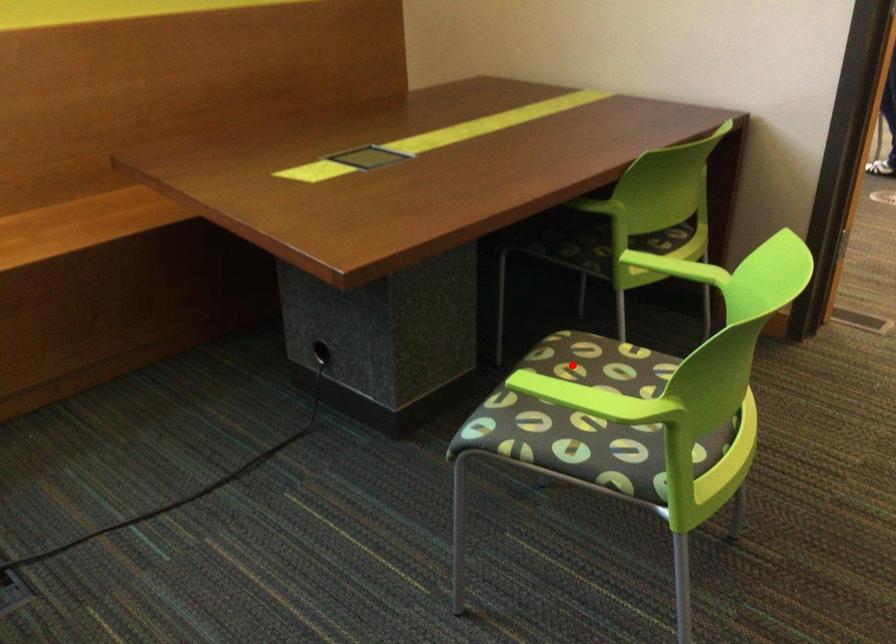
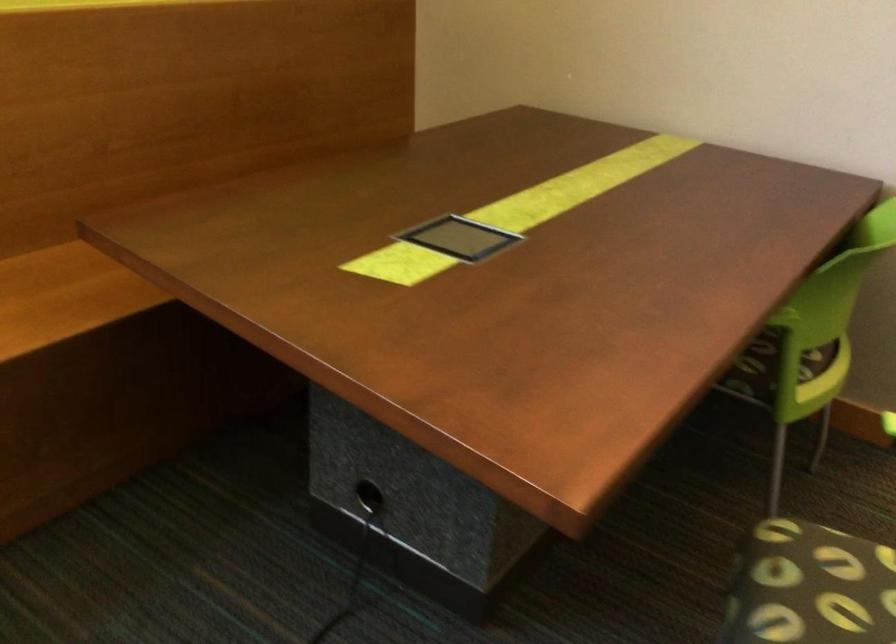
Locate, in the second image, the point that corresponds to the highlighted location in the first image.

(815, 587)